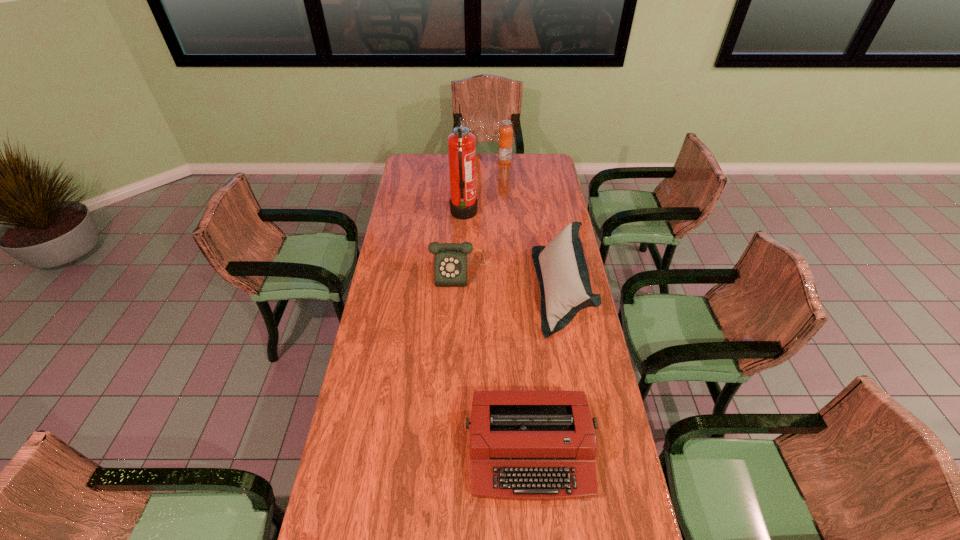
At what (x,y) coordinates should I click in order to perform the action: click on vacant space located on the surface of the cushion. Please return your answer as a coordinate pair (x, y). This screenshot has height=540, width=960. Looking at the image, I should click on (491, 291).

The height and width of the screenshot is (540, 960). What are the coordinates of `vacant space located on the surface of the cushion` in the screenshot? It's located at (483, 291).

The height and width of the screenshot is (540, 960). In order to click on free space located 0.400m on the dial of the telephone in this screenshot , I will do `click(459, 369)`.

The height and width of the screenshot is (540, 960). I want to click on object that is at the far edge, so click(505, 142).

Where is `cushion located in the right edge section of the desktop`? This screenshot has height=540, width=960. cushion located in the right edge section of the desktop is located at coordinates (561, 268).

Where is `typewriter present at the right edge`? typewriter present at the right edge is located at coordinates (524, 444).

Find the location of a particular element. The width and height of the screenshot is (960, 540). vacant space at the left edge of the desktop is located at coordinates (420, 182).

Identify the location of free space at the right edge of the desktop. The width and height of the screenshot is (960, 540). (540, 221).

Identify the location of free space between the cushion and the nearest object. This screenshot has width=960, height=540. (545, 372).

Image resolution: width=960 pixels, height=540 pixels. In order to click on free spot between the fourth shortest object and the telephone in this screenshot , I will do `click(484, 217)`.